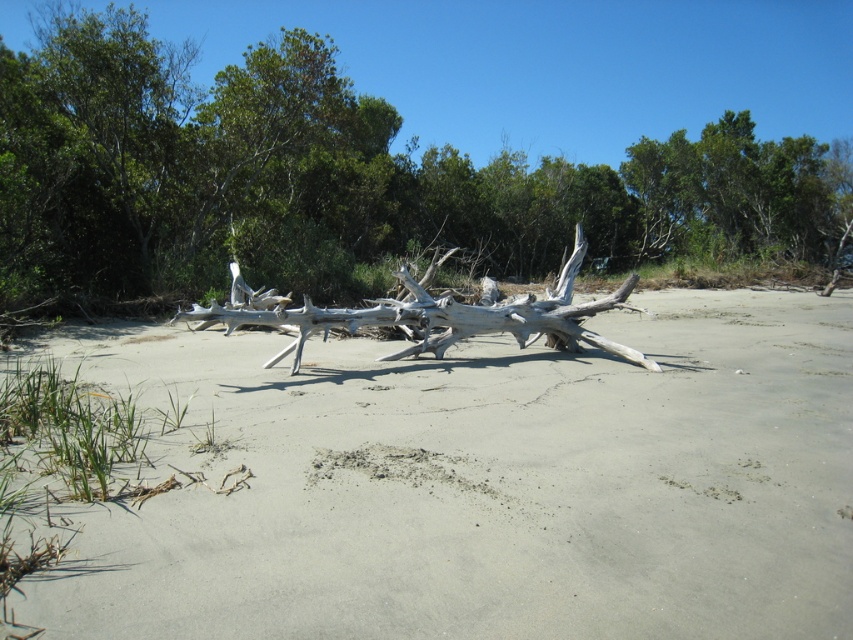
Looking at this image, is white driftwood at center below gray driftwood at center?

Incorrect, white driftwood at center is not positioned below gray driftwood at center.

Which of these two, white driftwood at center or gray driftwood at center, stands shorter?

gray driftwood at center

The height and width of the screenshot is (640, 853). I want to click on white driftwood at center, so click(x=407, y=156).

Consider the image. Is gray sand at center shorter than gray driftwood at center?

Yes.

Which is in front, point (827, 586) or point (354, 312)?

Point (827, 586) is more forward.

Image resolution: width=853 pixels, height=640 pixels. What are the coordinates of `gray sand at center` in the screenshot? It's located at (480, 483).

Who is higher up, gray sand at center or white driftwood at center?

white driftwood at center is above.

Does gray sand at center appear over white driftwood at center?

No, gray sand at center is not above white driftwood at center.

Where is `gray sand at center`? gray sand at center is located at coordinates (480, 483).